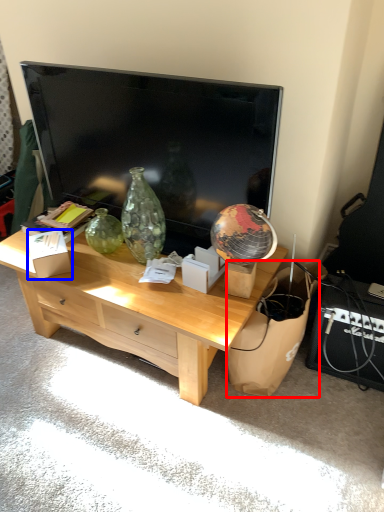
Question: Which point is further to the camera, cardboard (highlighted by a red box) or cardboard box (highlighted by a blue box)?

Choices:
 (A) cardboard
 (B) cardboard box

Answer: (B)